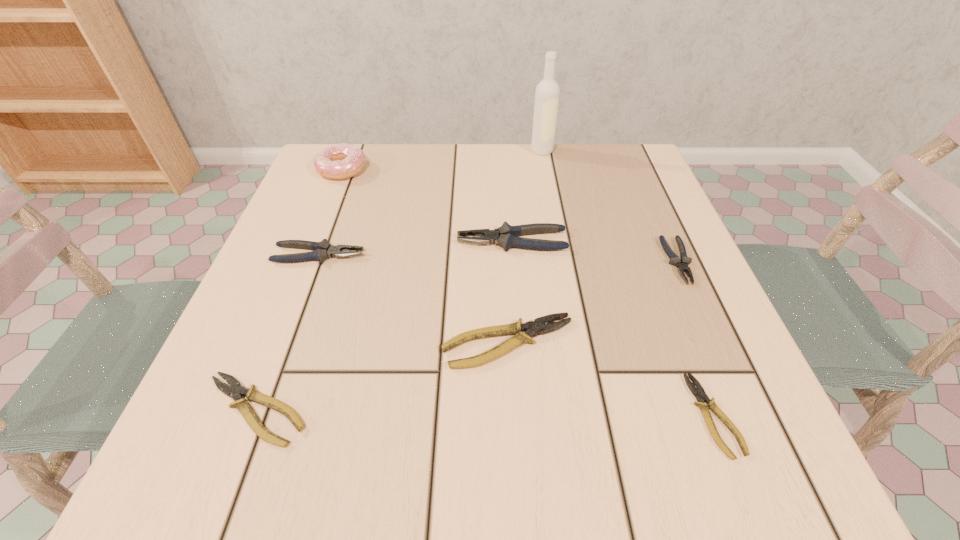
Find the location of a particular element. object present at the near right corner is located at coordinates (699, 393).

I want to click on free space at the far edge of the desktop, so click(509, 157).

This screenshot has height=540, width=960. Identify the location of vacant space at the near edge of the desktop. (x=624, y=446).

Find the location of a particular element. This screenshot has height=540, width=960. vacant space at the left edge is located at coordinates (301, 296).

The height and width of the screenshot is (540, 960). What are the coordinates of `free spot at the right edge of the desktop` in the screenshot? It's located at (715, 313).

Where is `vacant space at the far right corner of the desktop`? vacant space at the far right corner of the desktop is located at coordinates (615, 152).

In order to click on empty space between the white vodka and the third tallest object in this screenshot , I will do `click(527, 196)`.

This screenshot has width=960, height=540. What are the coordinates of `empty location between the seventh nearest object and the rightmost gray pliers` in the screenshot? It's located at (510, 215).

The width and height of the screenshot is (960, 540). Identify the location of free space between the rightmost gray pliers and the fifth shortest pliers. (498, 258).

Locate an element on the screen. The height and width of the screenshot is (540, 960). free space between the smallest gray pliers and the shortest pliers is located at coordinates (696, 338).